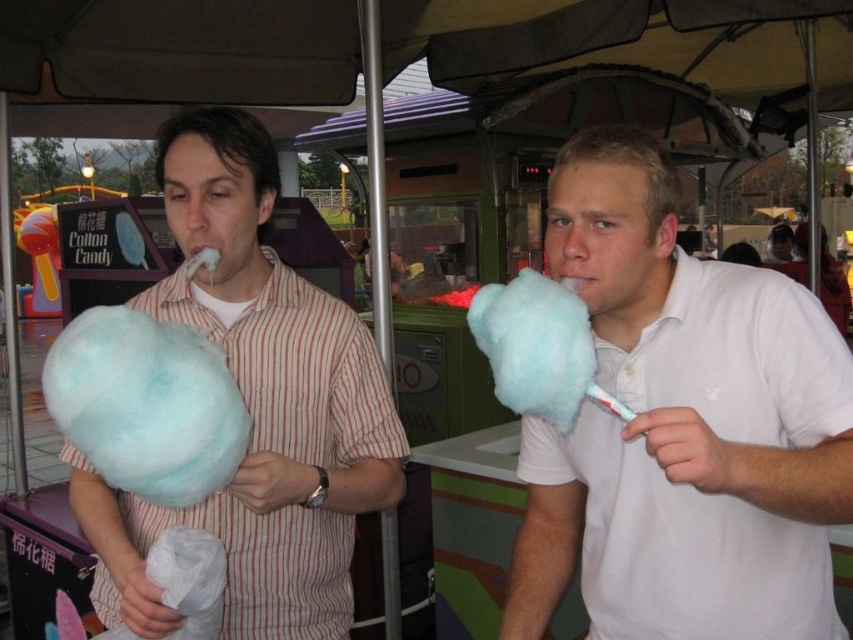
Question: Which of the following is the closest to the observer?

Choices:
 (A) (734, 422)
 (B) (213, 132)

Answer: (A)

Question: Which point appears farthest from the camera in this image?

Choices:
 (A) (196, 145)
 (B) (804, 547)

Answer: (A)

Question: Considering the relative positions of white cotton candy at center and matte cotton candy at left in the image provided, where is white cotton candy at center located with respect to matte cotton candy at left?

Choices:
 (A) left
 (B) right

Answer: (B)

Question: Does matte cotton candy at left have a larger size compared to light blue fluffy cotton candy at left?

Choices:
 (A) no
 (B) yes

Answer: (B)

Question: Considering the real-world distances, which object is farthest from the white cotton candy at center?

Choices:
 (A) matte cotton candy at left
 (B) light blue fluffy cotton candy at left

Answer: (B)

Question: Is white cotton candy at center to the right of matte cotton candy at left from the viewer's perspective?

Choices:
 (A) no
 (B) yes

Answer: (B)